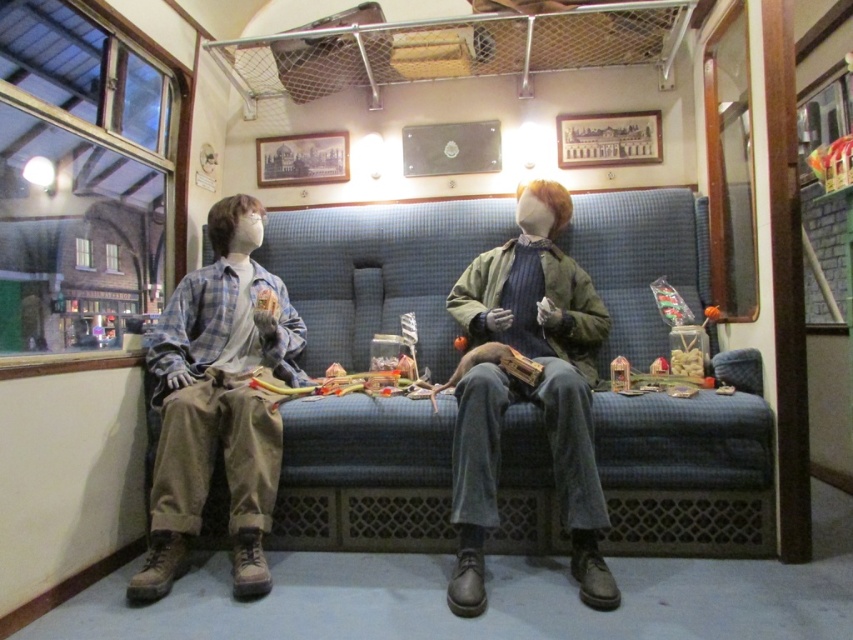
Question: Which is nearer to the denim shirt at left?

Choices:
 (A) denim jacket at center
 (B) blue fabric couch at center

Answer: (B)

Question: Which object is positioned closest to the denim shirt at left?

Choices:
 (A) denim jacket at center
 (B) blue fabric couch at center

Answer: (B)

Question: Which of the following is the closest to the observer?

Choices:
 (A) denim jacket at center
 (B) blue fabric couch at center

Answer: (A)

Question: Is denim shirt at left to the left of denim jacket at center from the viewer's perspective?

Choices:
 (A) no
 (B) yes

Answer: (B)

Question: Does blue fabric couch at center have a greater width compared to denim shirt at left?

Choices:
 (A) no
 (B) yes

Answer: (B)

Question: Can you confirm if blue fabric couch at center is wider than denim jacket at center?

Choices:
 (A) yes
 (B) no

Answer: (A)